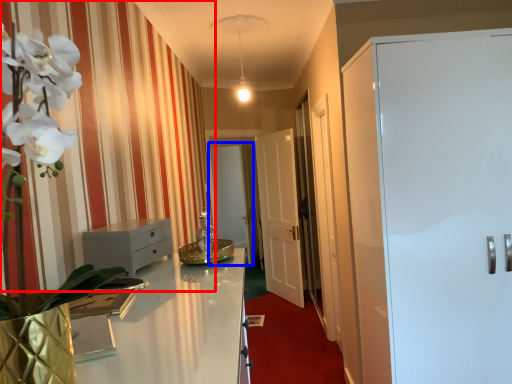
Question: Among these objects, which one is farthest to the camera, curtain (highlighted by a red box) or glass door (highlighted by a blue box)?

Choices:
 (A) curtain
 (B) glass door

Answer: (B)